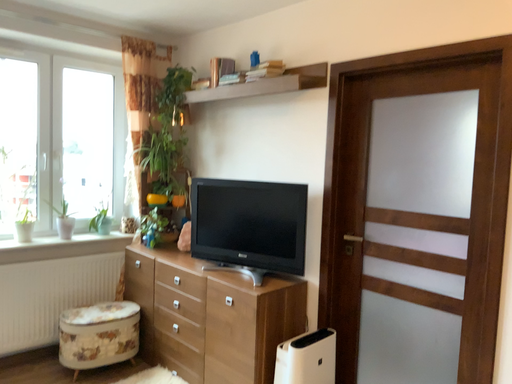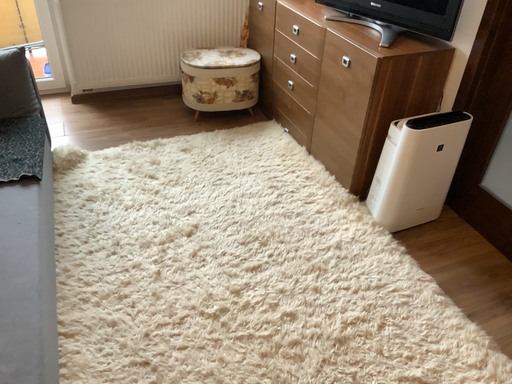
Question: How did the camera likely rotate when shooting the video?

Choices:
 (A) rotated left
 (B) rotated right

Answer: (A)